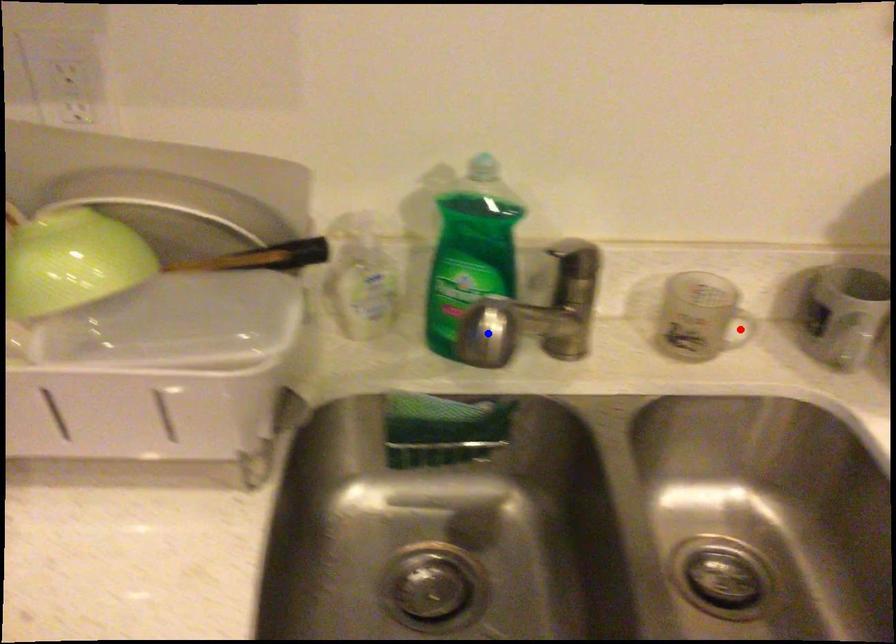
Question: Which of the two points in the image is closer to the camera?

Choices:
 (A) Blue point is closer.
 (B) Red point is closer.

Answer: (A)